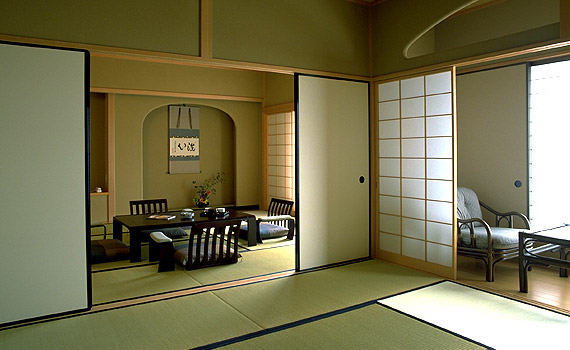
Locate an element on the screen. door is located at coordinates (320, 183), (498, 145), (46, 206).